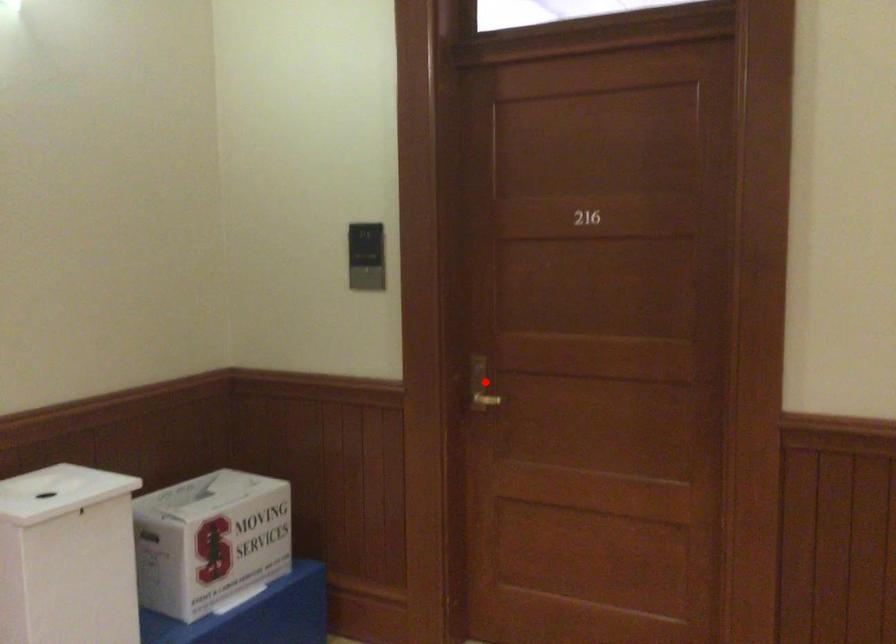
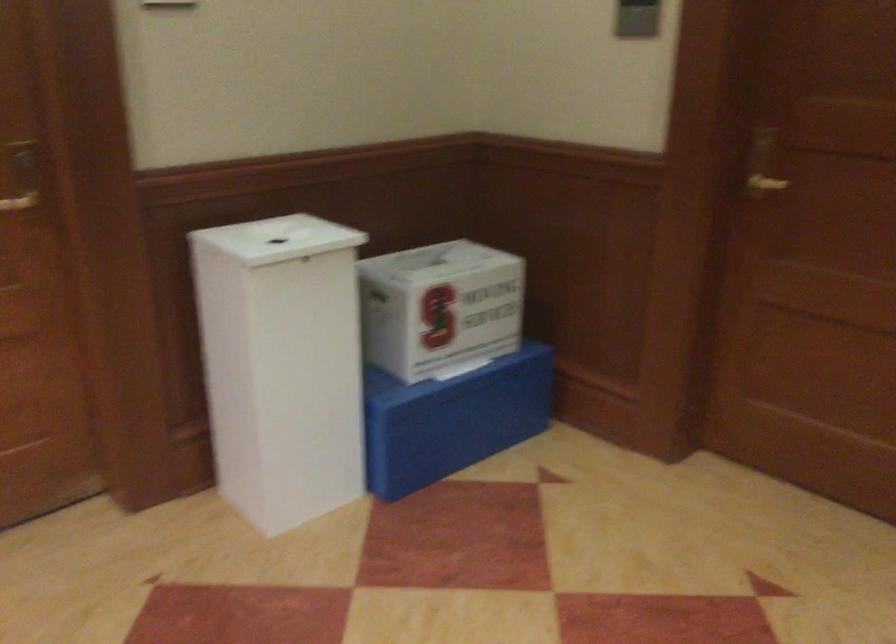
In the second image, find the point that corresponds to the highlighted location in the first image.

(762, 164)